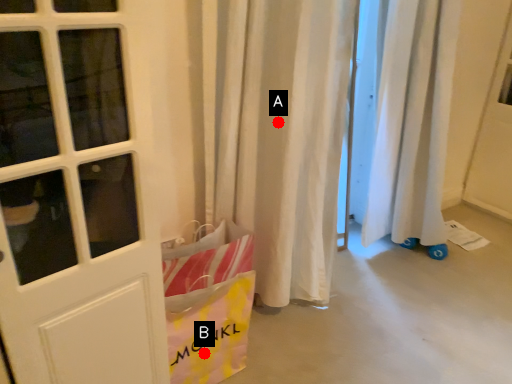
Question: Two points are circled on the image, labeled by A and B beside each circle. Among these points, which one is nearest to the camera?

Choices:
 (A) A is closer
 (B) B is closer

Answer: (B)